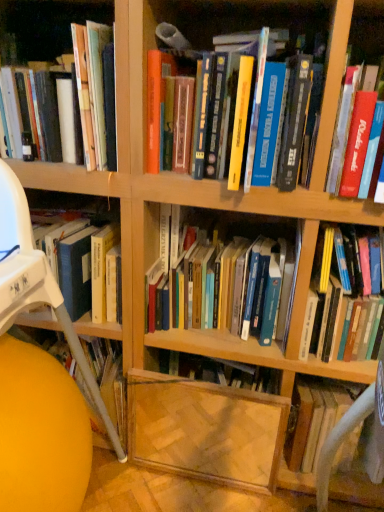
Question: Which direction should I rotate to look at hardcover books at center, the third book when ordered from left to right, — up or down?

Choices:
 (A) up
 (B) down

Answer: (B)

Question: Are wooden bookshelf at left, which is the 2th shelf in right-to-left order, and hardcover books at center, which is counted as the 4th book, starting from the right, beside each other?

Choices:
 (A) yes
 (B) no

Answer: (B)

Question: Is wooden bookshelf at left, which is the 2th shelf in right-to-left order, further to the viewer compared to hardcover books at center, which is counted as the 4th book, starting from the right?

Choices:
 (A) yes
 (B) no

Answer: (B)

Question: Does wooden bookshelf at left, which ranks as the first shelf in left-to-right order, have a greater width compared to hardcover books at center, which is counted as the 4th book, starting from the right?

Choices:
 (A) yes
 (B) no

Answer: (A)

Question: Is wooden bookshelf at left, which ranks as the first shelf in left-to-right order, not near hardcover books at center, which is counted as the 4th book, starting from the right?

Choices:
 (A) no
 (B) yes

Answer: (A)

Question: Is wooden bookshelf at left, which is the 2th shelf in right-to-left order, positioned in front of hardcover books at center, which is counted as the 4th book, starting from the right?

Choices:
 (A) no
 (B) yes

Answer: (B)

Question: From a real-world perspective, is wooden bookshelf at left, which is the 2th shelf in right-to-left order, on top of hardcover books at center, which is counted as the 4th book, starting from the right?

Choices:
 (A) yes
 (B) no

Answer: (B)

Question: Would you say white fabric computer chair at right is part of wooden bookshelf at left, which ranks as the first shelf in left-to-right order,'s contents?

Choices:
 (A) no
 (B) yes

Answer: (A)

Question: Is wooden bookshelf at left, which ranks as the first shelf in left-to-right order, shorter than white fabric computer chair at right?

Choices:
 (A) no
 (B) yes

Answer: (A)

Question: Is wooden bookshelf at left, which is the 2th shelf in right-to-left order, positioned with its back to white fabric computer chair at right?

Choices:
 (A) yes
 (B) no

Answer: (B)

Question: Considering the relative sizes of wooden bookshelf at left, which is the 2th shelf in right-to-left order, and white fabric computer chair at right in the image provided, is wooden bookshelf at left, which is the 2th shelf in right-to-left order, wider than white fabric computer chair at right?

Choices:
 (A) no
 (B) yes

Answer: (B)

Question: Can you confirm if wooden bookshelf at left, which ranks as the first shelf in left-to-right order, is taller than white fabric computer chair at right?

Choices:
 (A) yes
 (B) no

Answer: (A)

Question: Is wooden bookshelf at left, which is the 2th shelf in right-to-left order, with white fabric computer chair at right?

Choices:
 (A) no
 (B) yes

Answer: (A)

Question: From a real-world perspective, is wooden bookshelf at left, which ranks as the first shelf in left-to-right order, under matte yellow ball at lower left?

Choices:
 (A) yes
 (B) no

Answer: (B)